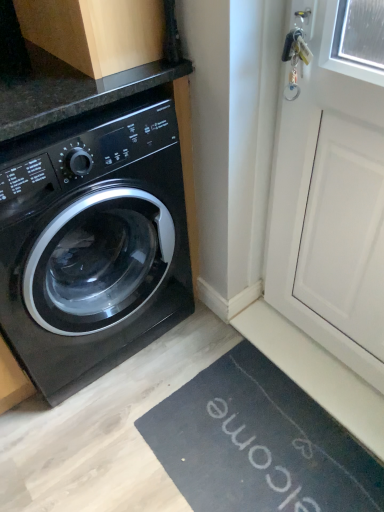
The height and width of the screenshot is (512, 384). In order to click on black rubber bath mat at lower right in this screenshot , I will do `click(258, 443)`.

Describe the element at coordinates (95, 32) in the screenshot. The width and height of the screenshot is (384, 512). I see `wooden cabinet at upper left` at that location.

Where is `white matte screen door at upper right`? The width and height of the screenshot is (384, 512). white matte screen door at upper right is located at coordinates (332, 188).

What do you see at coordinates (332, 188) in the screenshot? This screenshot has height=512, width=384. I see `white matte screen door at upper right` at bounding box center [332, 188].

Where is `black rubber bath mat at lower right`? The image size is (384, 512). black rubber bath mat at lower right is located at coordinates (258, 443).

Looking at this image, from a real-world perspective, is wooden cabinet at upper left physically located above or below white matte screen door at upper right?

Clearly, from a real-world perspective, wooden cabinet at upper left is above white matte screen door at upper right.

Considering the relative positions of wooden cabinet at upper left and white matte screen door at upper right in the image provided, is wooden cabinet at upper left to the left or to the right of white matte screen door at upper right?

In the image, wooden cabinet at upper left appears on the left side of white matte screen door at upper right.

Can you tell me how much wooden cabinet at upper left and white matte screen door at upper right differ in facing direction?

2.04 degrees.

Considering the relative sizes of wooden cabinet at upper left and white matte screen door at upper right in the image provided, is wooden cabinet at upper left taller than white matte screen door at upper right?

No.

Does white matte screen door at upper right have a larger size compared to black glossy washing machine at left?

Incorrect, white matte screen door at upper right is not larger than black glossy washing machine at left.

From the image's perspective, who appears lower, white matte screen door at upper right or black glossy washing machine at left?

white matte screen door at upper right appears lower in the image.

From a real-world perspective, is white matte screen door at upper right beneath black glossy washing machine at left?

Incorrect, from a real-world perspective, white matte screen door at upper right is higher than black glossy washing machine at left.

Can you confirm if white matte screen door at upper right is positioned to the left of black glossy washing machine at left?

No.

Which point is more forward, (129,56) or (229,438)?

Positioned in front is point (129,56).

Is wooden cabinet at upper left thinner than black rubber bath mat at lower right?

Correct, the width of wooden cabinet at upper left is less than that of black rubber bath mat at lower right.

Is wooden cabinet at upper left oriented towards black rubber bath mat at lower right?

No, wooden cabinet at upper left is not oriented towards black rubber bath mat at lower right.

Does wooden cabinet at upper left touch black rubber bath mat at lower right?

wooden cabinet at upper left and black rubber bath mat at lower right are clearly separated.

From a real-world perspective, who is located lower, black glossy washing machine at left or black rubber bath mat at lower right?

From a 3D spatial view, black rubber bath mat at lower right is below.

Is the surface of black glossy washing machine at left in direct contact with black rubber bath mat at lower right?

No, black glossy washing machine at left is not making contact with black rubber bath mat at lower right.

Which is correct: black glossy washing machine at left is inside black rubber bath mat at lower right, or outside of it?

black glossy washing machine at left is not enclosed by black rubber bath mat at lower right.

From the image's perspective, who appears lower, black glossy washing machine at left or black rubber bath mat at lower right?

black rubber bath mat at lower right is shown below in the image.

From a real-world perspective, which is physically below, white matte screen door at upper right or black rubber bath mat at lower right?

In real-world perspective, black rubber bath mat at lower right is lower.

Is white matte screen door at upper right at the right side of black rubber bath mat at lower right?

Indeed, white matte screen door at upper right is positioned on the right side of black rubber bath mat at lower right.

Considering the sizes of objects white matte screen door at upper right and black rubber bath mat at lower right in the image provided, who is bigger, white matte screen door at upper right or black rubber bath mat at lower right?

Bigger between the two is white matte screen door at upper right.

Based on the photo, is white matte screen door at upper right facing towards black rubber bath mat at lower right?

Yes, white matte screen door at upper right is aimed at black rubber bath mat at lower right.

Is black rubber bath mat at lower right facing towards white matte screen door at upper right?

No, black rubber bath mat at lower right is not oriented towards white matte screen door at upper right.

Which object is closer to the camera taking this photo, black rubber bath mat at lower right or white matte screen door at upper right?

white matte screen door at upper right is more forward.

Is point (285, 508) positioned after point (352, 284)?

That is False.

From a real-world perspective, between black rubber bath mat at lower right and white matte screen door at upper right, who is vertically higher?

white matte screen door at upper right.

Is there a large distance between black glossy washing machine at left and wooden cabinet at upper left?

No, black glossy washing machine at left is not far away from wooden cabinet at upper left.

This screenshot has width=384, height=512. Find the location of `washing machine below the wooden cabinet at upper left (from the image's perspective)`. washing machine below the wooden cabinet at upper left (from the image's perspective) is located at coordinates tap(93, 241).

Between black glossy washing machine at left and wooden cabinet at upper left, which one is positioned in front?

black glossy washing machine at left is in front.

The image size is (384, 512). Find the location of `screen door that appears in front of the wooden cabinet at upper left`. screen door that appears in front of the wooden cabinet at upper left is located at coordinates coord(332,188).

I want to click on washing machine behind the white matte screen door at upper right, so click(93, 241).

Based on their spatial positions, is wooden cabinet at upper left or black glossy washing machine at left closer to white matte screen door at upper right?

black glossy washing machine at left.

Considering their positions, is black glossy washing machine at left positioned further to wooden cabinet at upper left than black rubber bath mat at lower right?

black rubber bath mat at lower right is positioned further to the anchor wooden cabinet at upper left.

Considering their positions, is black rubber bath mat at lower right positioned closer to wooden cabinet at upper left than black glossy washing machine at left?

black glossy washing machine at left is positioned closer to the anchor wooden cabinet at upper left.

Considering their positions, is white matte screen door at upper right positioned further to black glossy washing machine at left than black rubber bath mat at lower right?

black rubber bath mat at lower right.

Looking at the image, which one is located closer to black rubber bath mat at lower right, white matte screen door at upper right or black glossy washing machine at left?

white matte screen door at upper right is positioned closer to the anchor black rubber bath mat at lower right.

Based on their spatial positions, is wooden cabinet at upper left or black rubber bath mat at lower right closer to white matte screen door at upper right?

black rubber bath mat at lower right.

When comparing their distances from black rubber bath mat at lower right, does wooden cabinet at upper left or black glossy washing machine at left seem further?

wooden cabinet at upper left is further to black rubber bath mat at lower right.

Considering their positions, is wooden cabinet at upper left positioned further to black rubber bath mat at lower right than white matte screen door at upper right?

Based on the image, wooden cabinet at upper left appears to be further to black rubber bath mat at lower right.

Find the location of a particular element. The image size is (384, 512). cabinetry between black glossy washing machine at left and white matte screen door at upper right from left to right is located at coordinates [95, 32].

The height and width of the screenshot is (512, 384). I want to click on washing machine between wooden cabinet at upper left and black rubber bath mat at lower right from top to bottom, so click(x=93, y=241).

At what (x,y) coordinates should I click in order to perform the action: click on screen door between wooden cabinet at upper left and black rubber bath mat at lower right vertically. Please return your answer as a coordinate pair (x, y). This screenshot has width=384, height=512. Looking at the image, I should click on (332, 188).

This screenshot has width=384, height=512. What are the coordinates of `bath mat between black glossy washing machine at left and white matte screen door at upper right` in the screenshot? It's located at (258, 443).